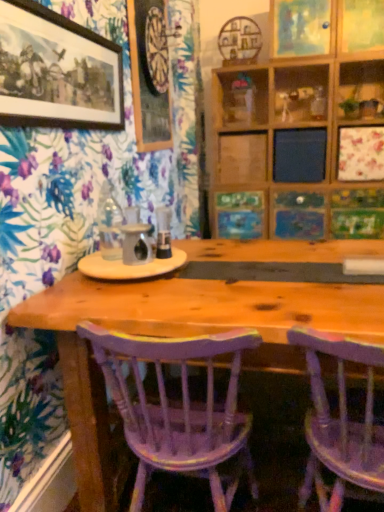
Question: Which direction should I rotate to look at wooden picture frame at upper center, the second picture frame viewed from the left?

Choices:
 (A) left
 (B) right

Answer: (A)

Question: Considering the relative sizes of matte black picture frame at upper left, which is the 1th picture frame from front to back, and pastel painted picture at upper center, which is the 2th decorative picture from bottom to top, in the image provided, is matte black picture frame at upper left, which is the 1th picture frame from front to back, shorter than pastel painted picture at upper center, which is the 2th decorative picture from bottom to top,?

Choices:
 (A) yes
 (B) no

Answer: (A)

Question: Considering the relative positions of matte black picture frame at upper left, which appears as the third picture frame when viewed from the right, and pastel painted picture at upper center, which is the 2th decorative picture from bottom to top, in the image provided, is matte black picture frame at upper left, which appears as the third picture frame when viewed from the right, behind pastel painted picture at upper center, which is the 2th decorative picture from bottom to top,?

Choices:
 (A) no
 (B) yes

Answer: (A)

Question: Is matte black picture frame at upper left, the 1th picture frame positioned from the left, with pastel painted picture at upper center, the first decorative picture viewed from the top?

Choices:
 (A) no
 (B) yes

Answer: (A)

Question: Is matte black picture frame at upper left, which appears as the third picture frame when viewed from the right, looking in the opposite direction of pastel painted picture at upper center, which is the 2th decorative picture from bottom to top?

Choices:
 (A) no
 (B) yes

Answer: (A)

Question: Is there a large distance between matte black picture frame at upper left, the third picture frame when ordered from back to front, and pastel painted picture at upper center, the first decorative picture viewed from the top?

Choices:
 (A) yes
 (B) no

Answer: (A)

Question: Does matte black picture frame at upper left, the 1th picture frame positioned from the left, appear on the left side of pastel painted picture at upper center, the first decorative picture viewed from the top?

Choices:
 (A) no
 (B) yes

Answer: (B)

Question: From a real-world perspective, is purple painted wood chair at center, placed as the 2th chair when sorted from right to left, below wooden painted picture frame at center, the 1th decorative picture in the bottom-to-top sequence?

Choices:
 (A) no
 (B) yes

Answer: (B)

Question: From the image's perspective, is purple painted wood chair at center, placed as the 2th chair when sorted from right to left, located beneath wooden painted picture frame at center, the second decorative picture from the top?

Choices:
 (A) yes
 (B) no

Answer: (A)

Question: Is purple painted wood chair at center, placed as the 2th chair when sorted from right to left, shorter than wooden painted picture frame at center, the 1th decorative picture in the bottom-to-top sequence?

Choices:
 (A) yes
 (B) no

Answer: (B)

Question: Is purple painted wood chair at center, placed as the 2th chair when sorted from right to left, thinner than wooden painted picture frame at center, the 1th decorative picture in the bottom-to-top sequence?

Choices:
 (A) no
 (B) yes

Answer: (A)

Question: Is purple painted wood chair at center, arranged as the first chair when viewed from the left, placed right next to wooden painted picture frame at center, the second decorative picture from the top?

Choices:
 (A) yes
 (B) no

Answer: (B)

Question: Is purple painted wood chair at center, arranged as the first chair when viewed from the left, far from wooden painted picture frame at center, the 1th decorative picture in the bottom-to-top sequence?

Choices:
 (A) yes
 (B) no

Answer: (A)

Question: Is wooden picture frame at upper right, placed as the 3th picture frame when sorted from left to right, taller than wooden picture frame at upper center, the second picture frame viewed from the left?

Choices:
 (A) yes
 (B) no

Answer: (B)